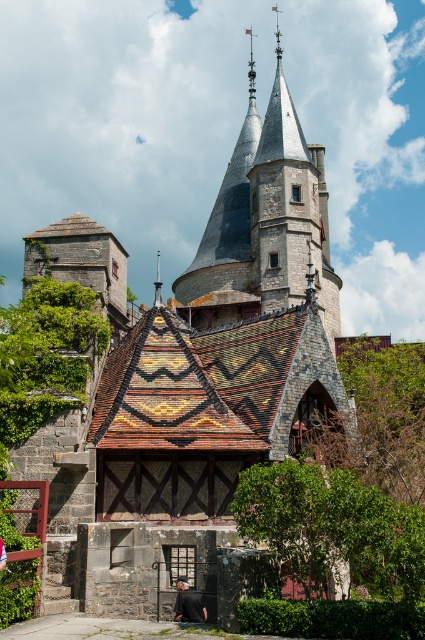
You are standing in front of the castle and notice a dark blue fabric at center and a black leather jacket at lower center. Which item is closer to you?

The dark blue fabric at center is closer to you because it is further to the viewer than the black leather jacket at lower center.

You are a medieval knight standing in front of the castle. You see a dark blue fabric at center and a black leather jacket at lower center. Which item is larger in size?

The dark blue fabric at center is bigger than the black leather jacket at lower center.